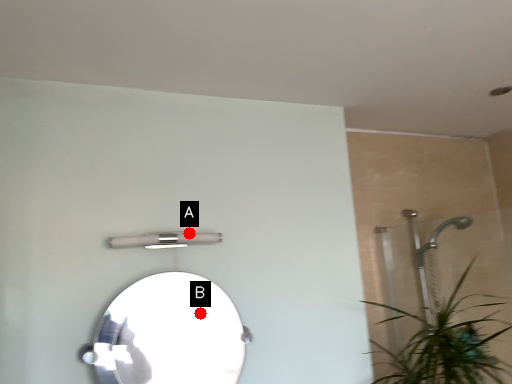
Question: Two points are circled on the image, labeled by A and B beside each circle. Which point appears closest to the camera in this image?

Choices:
 (A) A is closer
 (B) B is closer

Answer: (B)